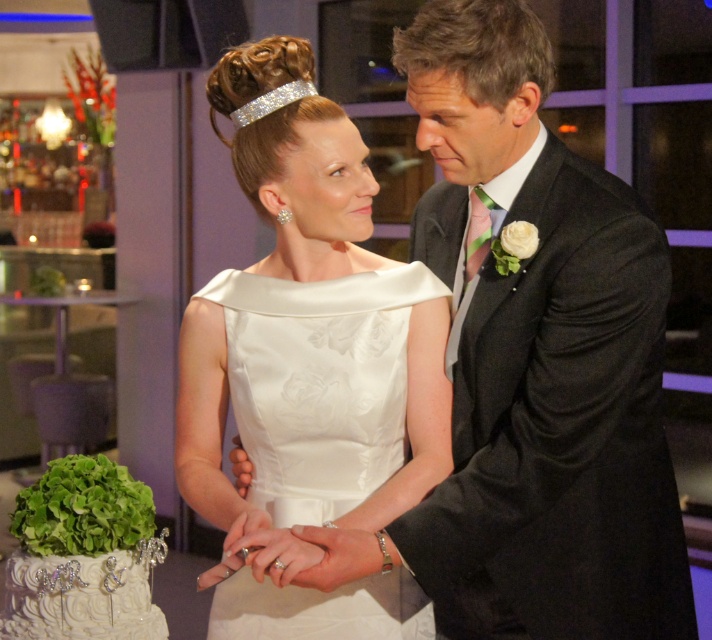
The height and width of the screenshot is (640, 712). What do you see at coordinates (538, 356) in the screenshot?
I see `black textured suit at center` at bounding box center [538, 356].

Does black textured suit at center appear under satin dress at center?

Yes, black textured suit at center is below satin dress at center.

The image size is (712, 640). What do you see at coordinates (538, 356) in the screenshot? I see `black textured suit at center` at bounding box center [538, 356].

Image resolution: width=712 pixels, height=640 pixels. Find the location of `black textured suit at center`. black textured suit at center is located at coordinates (538, 356).

Based on the photo, is satin dress at center positioned before white textured cake at lower left?

That is True.

Is point (248, 605) positioned before point (52, 628)?

Yes, it is.

The image size is (712, 640). Identify the location of satin dress at center. pyautogui.click(x=308, y=362).

Between black textured suit at center and white textured cake at lower left, which one appears on the left side from the viewer's perspective?

white textured cake at lower left is more to the left.

Between point (597, 544) and point (70, 467), which one is positioned in front?

Point (597, 544)

The image size is (712, 640). Describe the element at coordinates (538, 356) in the screenshot. I see `black textured suit at center` at that location.

What are the coordinates of `black textured suit at center` in the screenshot? It's located at (538, 356).